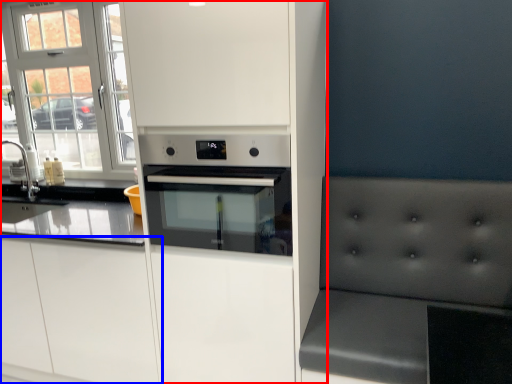
Question: Which of the following is the farthest to the observer, cabinetry (highlighted by a red box) or cabinetry (highlighted by a blue box)?

Choices:
 (A) cabinetry
 (B) cabinetry

Answer: (B)